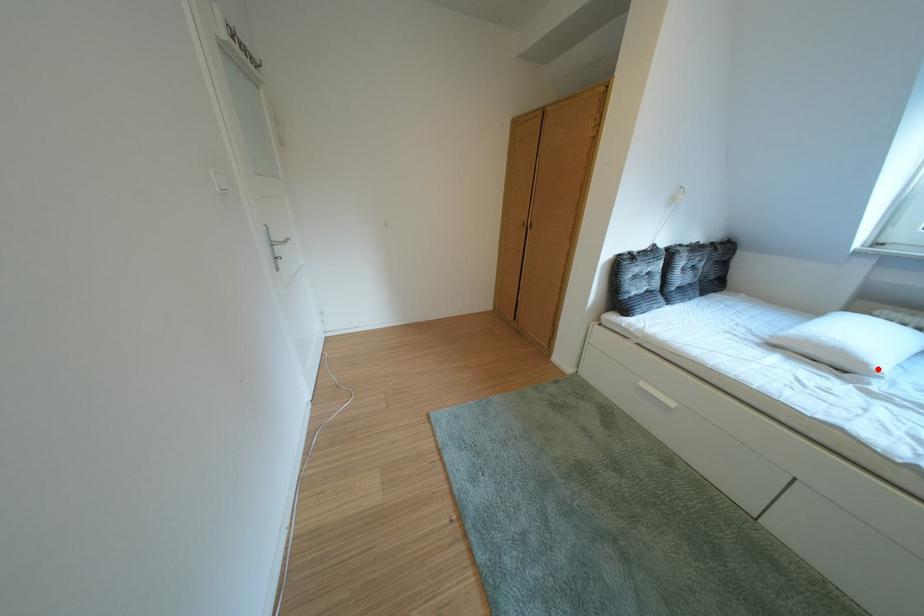
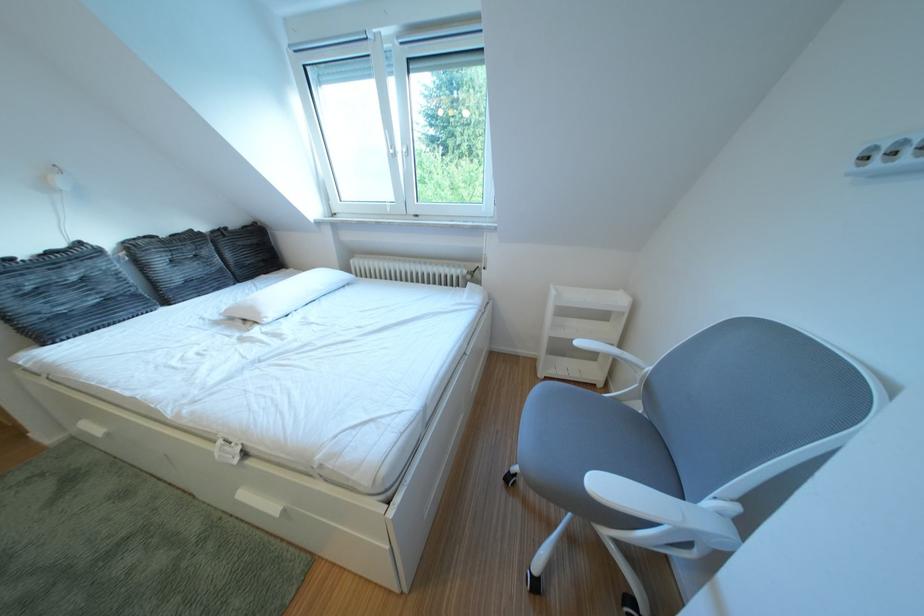
In the second image, find the point that corresponds to the highlighted location in the first image.

(273, 318)